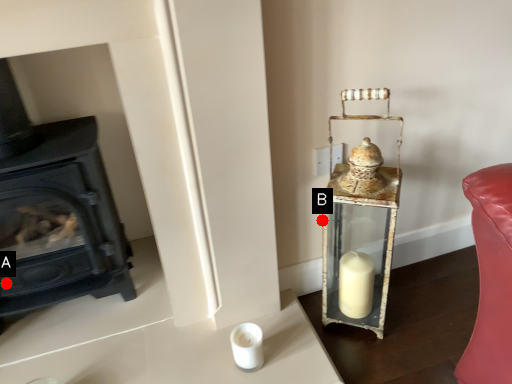
Question: Two points are circled on the image, labeled by A and B beside each circle. Which point appears closest to the camera in this image?

Choices:
 (A) A is closer
 (B) B is closer

Answer: (A)